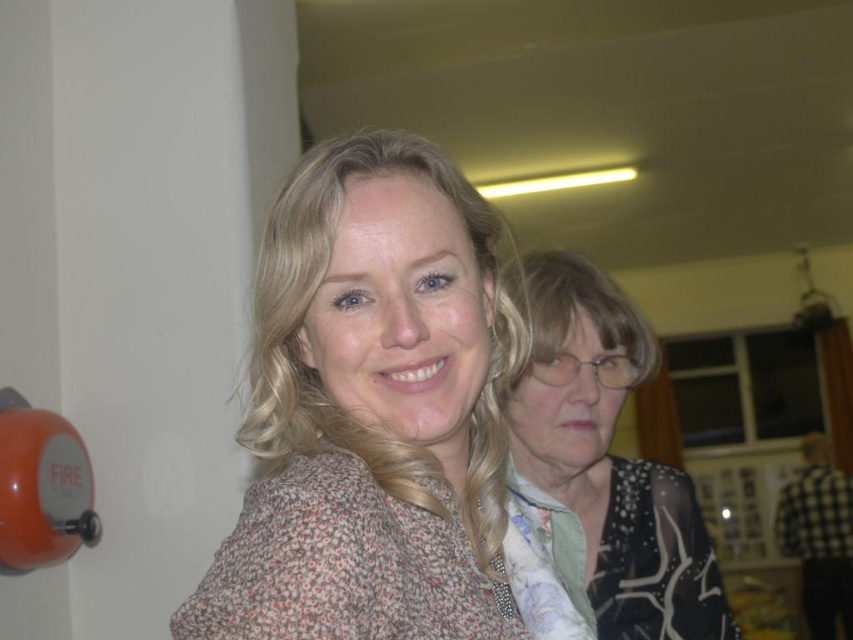
Question: Which object is farther from the camera taking this photo?

Choices:
 (A) floral-patterned fabric at center
 (B) black dotted blouse at right

Answer: (B)

Question: Which point is farther to the camera?

Choices:
 (A) (332, 572)
 (B) (672, 588)

Answer: (B)

Question: Can you confirm if floral-patterned fabric at center is positioned above black dotted blouse at right?

Choices:
 (A) no
 (B) yes

Answer: (B)

Question: Which point appears farthest from the camera in this image?

Choices:
 (A) (271, 416)
 (B) (534, 481)

Answer: (B)

Question: Observing the image, what is the correct spatial positioning of floral-patterned fabric at center in reference to black dotted blouse at right?

Choices:
 (A) below
 (B) above

Answer: (B)

Question: Is floral-patterned fabric at center to the left of black dotted blouse at right from the viewer's perspective?

Choices:
 (A) no
 (B) yes

Answer: (B)